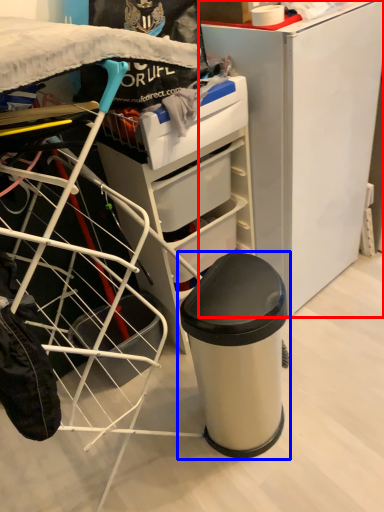
Question: Which point is closer to the camera, furniture (highlighted by a red box) or waste container (highlighted by a blue box)?

Choices:
 (A) furniture
 (B) waste container

Answer: (B)